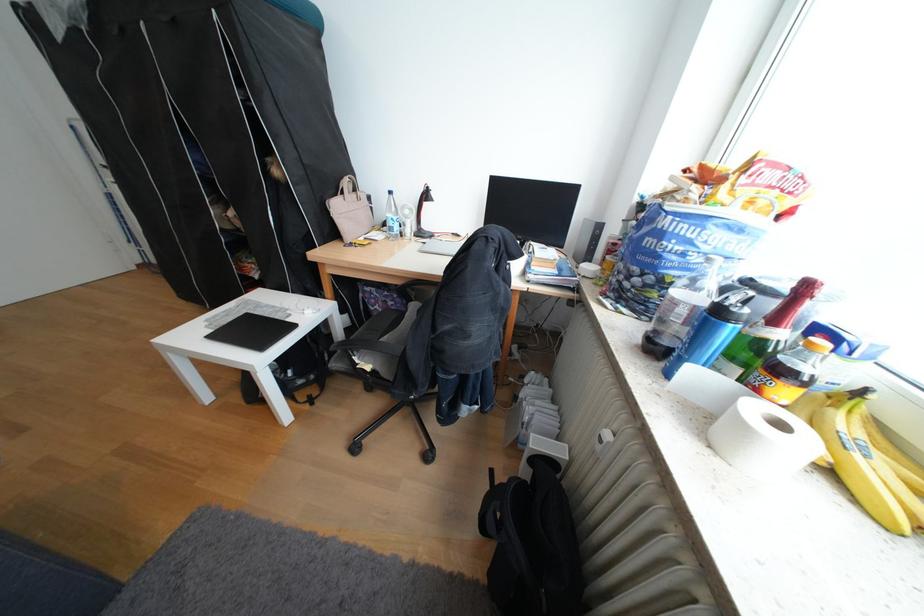
Where would you lift the beige bag handle? Please return your answer as a coordinate pair (x, y).

(343, 180)